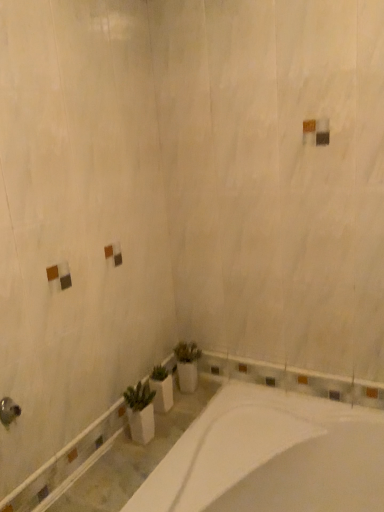
This screenshot has height=512, width=384. What do you see at coordinates (9, 411) in the screenshot?
I see `brushed metal showerhead at lower left` at bounding box center [9, 411].

Identify the location of brushed metal showerhead at lower left. (9, 411).

Identify the location of brushed metal showerhead at lower left. (9, 411).